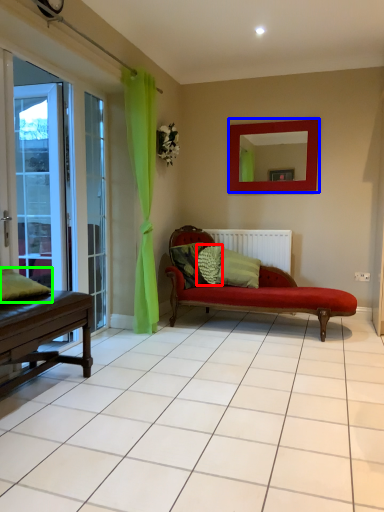
Question: Which object is the farthest from pillow (highlighted by a red box)? Choose among these: mirror (highlighted by a blue box) or pillow (highlighted by a green box).

Choices:
 (A) mirror
 (B) pillow

Answer: (B)